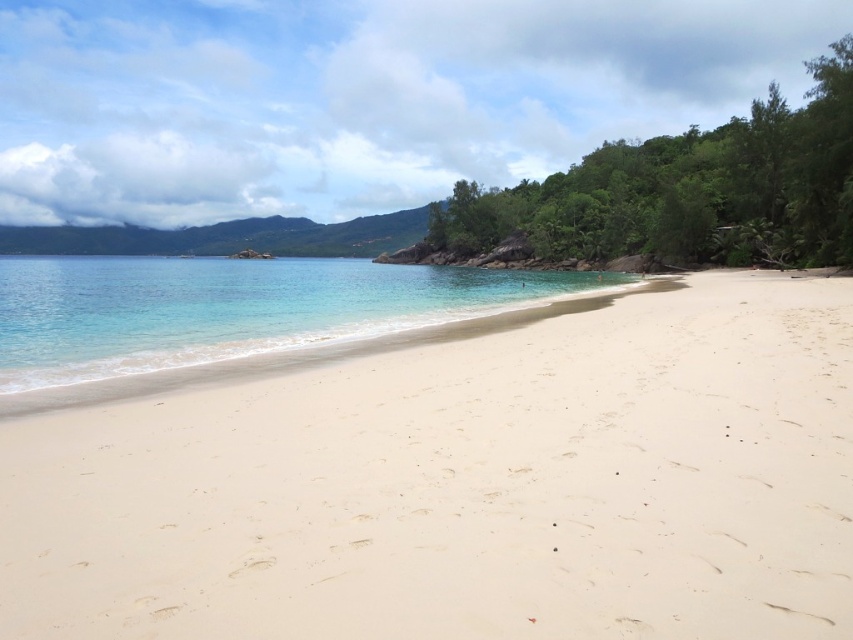
You are a beachgoer standing at the shoreline. You want to place your beach umbrella on the white sand at center so that it stays dry. Considering the position of the clear water at center, will the umbrella get wet from the water?

The white sand at center is positioned under clear water at center, so the clear water at center would likely cover the white sand at center, causing the umbrella to get wet.

You are standing at the shoreline on the beach and see two points marked on the sand. The first point is at coordinate point (473, 598), and the second point is at coordinate point (312, 300). Which point is closer to you?

Point (473, 598) is closer to the camera than point (312, 300), so the first point is closer to you.